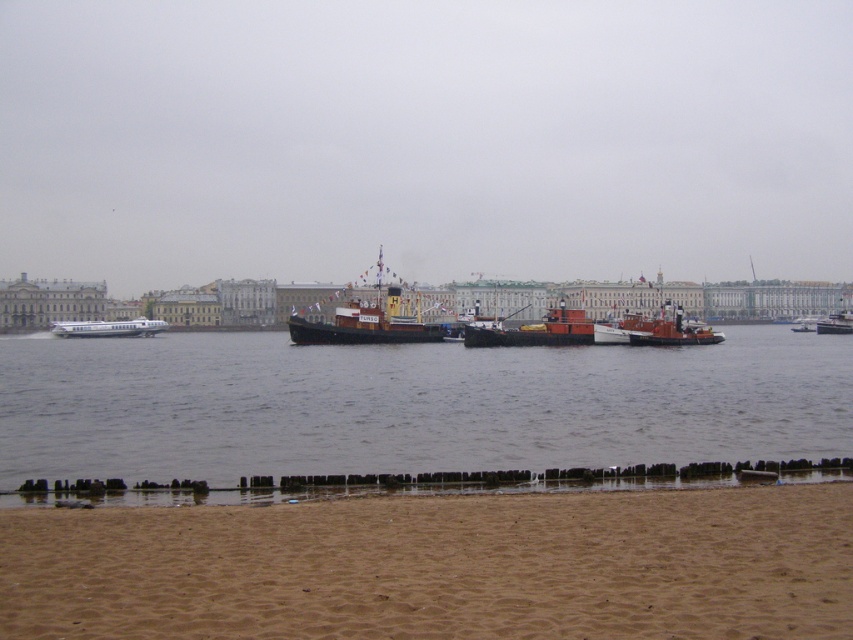
You are standing at the water edge and see the point marked at coordinates (669, 330). What object is located at that point?

The point at coordinates (669, 330) corresponds to the orange matte tugboat at center.